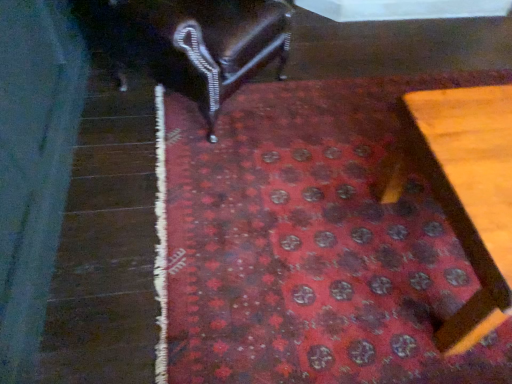
Question: Is red carpet at center in contact with shiny dark wood chair at upper left, positioned as the 2th furniture in right-to-left order?

Choices:
 (A) yes
 (B) no

Answer: (B)

Question: Would you say red carpet at center is a long distance from shiny dark wood chair at upper left, positioned as the 2th furniture in right-to-left order?

Choices:
 (A) yes
 (B) no

Answer: (B)

Question: Is red carpet at center wider than shiny dark wood chair at upper left, arranged as the 1th furniture when viewed from the top?

Choices:
 (A) no
 (B) yes

Answer: (B)

Question: Is red carpet at center facing away from shiny dark wood chair at upper left, placed as the first furniture when sorted from left to right?

Choices:
 (A) no
 (B) yes

Answer: (A)

Question: Can you confirm if red carpet at center is taller than shiny dark wood chair at upper left, which is the 2th furniture in bottom-to-top order?

Choices:
 (A) no
 (B) yes

Answer: (A)

Question: Is shiny dark wood chair at upper left, arranged as the 1th furniture when viewed from the top, situated inside red carpet at center or outside?

Choices:
 (A) outside
 (B) inside

Answer: (A)

Question: Considering the positions of shiny dark wood chair at upper left, placed as the first furniture when sorted from left to right, and red carpet at center in the image, is shiny dark wood chair at upper left, placed as the first furniture when sorted from left to right, wider or thinner than red carpet at center?

Choices:
 (A) wide
 (B) thin

Answer: (B)

Question: Is shiny dark wood chair at upper left, which is the 2th furniture in bottom-to-top order, in front of or behind red carpet at center in the image?

Choices:
 (A) front
 (B) behind

Answer: (B)

Question: From a real-world perspective, relative to red carpet at center, is shiny dark wood chair at upper left, positioned as the 2th furniture in right-to-left order, vertically above or below?

Choices:
 (A) below
 (B) above

Answer: (B)

Question: Is wooden table at lower right, which appears as the second furniture when viewed from the top, to the left or to the right of shiny dark wood chair at upper left, arranged as the 1th furniture when viewed from the top, in the image?

Choices:
 (A) right
 (B) left

Answer: (A)

Question: In the image, is wooden table at lower right, the second furniture in the left-to-right sequence, positioned in front of or behind shiny dark wood chair at upper left, placed as the first furniture when sorted from left to right?

Choices:
 (A) front
 (B) behind

Answer: (A)

Question: In terms of width, does wooden table at lower right, which appears as the second furniture when viewed from the top, look wider or thinner when compared to shiny dark wood chair at upper left, arranged as the 1th furniture when viewed from the top?

Choices:
 (A) thin
 (B) wide

Answer: (A)

Question: From a real-world perspective, relative to shiny dark wood chair at upper left, which is the 2th furniture in bottom-to-top order, is wooden table at lower right, the second furniture in the left-to-right sequence, vertically above or below?

Choices:
 (A) below
 (B) above

Answer: (A)

Question: Is red carpet at center taller or shorter than shiny dark wood chair at upper left, placed as the first furniture when sorted from left to right?

Choices:
 (A) short
 (B) tall

Answer: (A)

Question: In terms of size, does red carpet at center appear bigger or smaller than shiny dark wood chair at upper left, which is the 2th furniture in bottom-to-top order?

Choices:
 (A) small
 (B) big

Answer: (A)